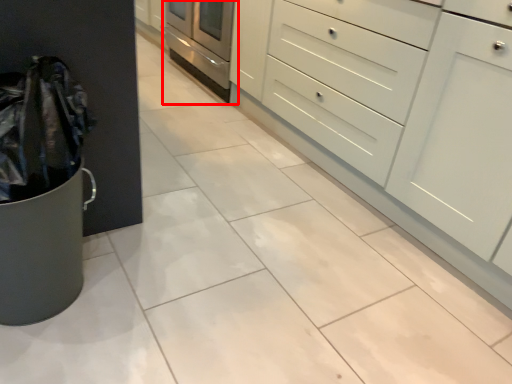
Question: Where is oven (annotated by the red box) located in relation to chest of drawers in the image?

Choices:
 (A) left
 (B) right

Answer: (A)